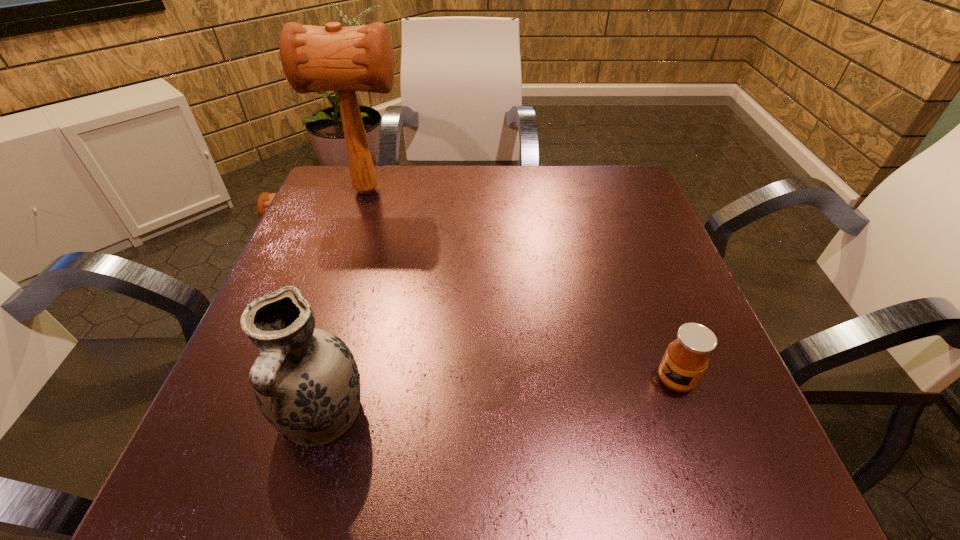
Where is `object positioned at the near edge`? The width and height of the screenshot is (960, 540). object positioned at the near edge is located at coordinates (306, 382).

This screenshot has width=960, height=540. Find the location of `mallet located in the left edge section of the desktop`. mallet located in the left edge section of the desktop is located at coordinates pyautogui.click(x=314, y=58).

Locate an element on the screen. vase at the left edge is located at coordinates (306, 382).

You are a GUI agent. You are given a task and a screenshot of the screen. Output one action in this format:
    pyautogui.click(x=<x>, y=<y>)
    Task: Click on the object at the right edge
    
    Given the screenshot: What is the action you would take?
    pyautogui.click(x=687, y=357)

Where is `object located in the far left corner section of the desktop`? The height and width of the screenshot is (540, 960). object located in the far left corner section of the desktop is located at coordinates (314, 58).

Locate an element on the screen. The width and height of the screenshot is (960, 540). object located in the near left corner section of the desktop is located at coordinates pos(306,382).

At what (x,y) coordinates should I click in order to perform the action: click on vacant area at the far edge of the desktop. Please return your answer as a coordinate pair (x, y). Image resolution: width=960 pixels, height=540 pixels. Looking at the image, I should click on pos(486,167).

In the image, there is a desktop. Where is `free space at the near edge`? free space at the near edge is located at coordinates (396, 486).

Image resolution: width=960 pixels, height=540 pixels. I want to click on free spot at the left edge of the desktop, so click(x=347, y=255).

You are a GUI agent. You are given a task and a screenshot of the screen. Output one action in this format:
    pyautogui.click(x=<x>, y=<y>)
    Task: Click on the free space at the right edge of the desktop
    The image size is (960, 540).
    Given the screenshot: What is the action you would take?
    pyautogui.click(x=631, y=224)